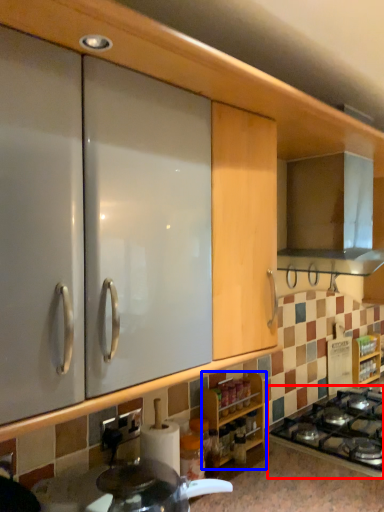
Question: Among these objects, which one is nearest to the camera, gas stove (highlighted by a red box) or cabinetry (highlighted by a blue box)?

Choices:
 (A) gas stove
 (B) cabinetry

Answer: (A)